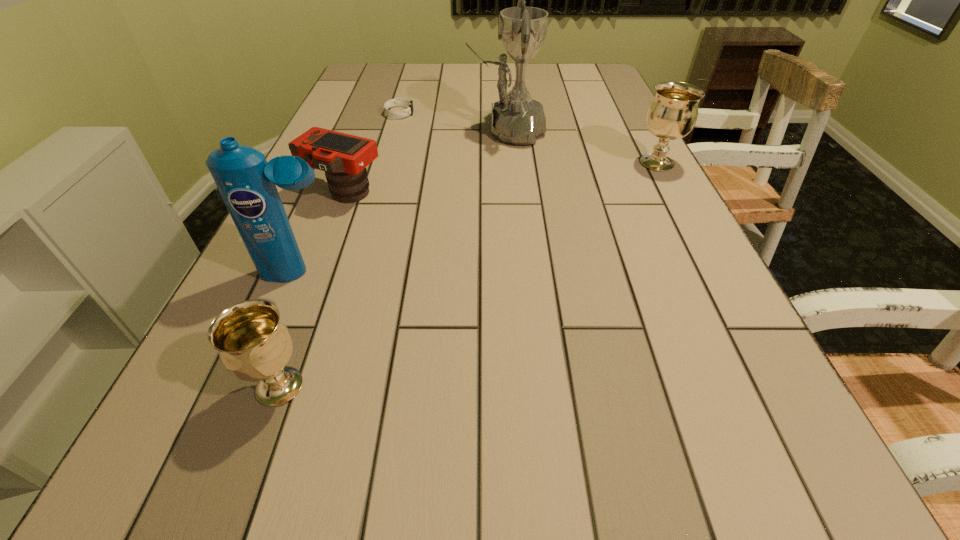
Locate an element on the screen. This screenshot has width=960, height=540. the left chalice is located at coordinates (254, 344).

Where is `the nearer chalice`? the nearer chalice is located at coordinates (254, 344).

This screenshot has width=960, height=540. Find the location of `the fourth shortest object`. the fourth shortest object is located at coordinates (672, 114).

I want to click on the farther chalice, so point(672,114).

This screenshot has height=540, width=960. What are the coordinates of `camera` in the screenshot? It's located at (344, 157).

You are a GUI agent. You are given a task and a screenshot of the screen. Output one action in this format:
    pyautogui.click(x=<x>, y=<y>)
    Task: Click on the award
    Image resolution: width=960 pixels, height=540 pixels.
    Given the screenshot: What is the action you would take?
    pyautogui.click(x=517, y=119)

Identify the location of the shortest object. This screenshot has width=960, height=540. pos(398,101).

Image resolution: width=960 pixels, height=540 pixels. Identify the location of shampoo. (247, 183).

At what (x,y) coordinates should I click in order to perform the action: click on the fifth shortest object. Please return your answer as a coordinate pair (x, y). The width and height of the screenshot is (960, 540). Looking at the image, I should click on (247, 183).

Where is `vacant area located 0.060m on the left of the shorter chalice`? This screenshot has height=540, width=960. vacant area located 0.060m on the left of the shorter chalice is located at coordinates coord(211,387).